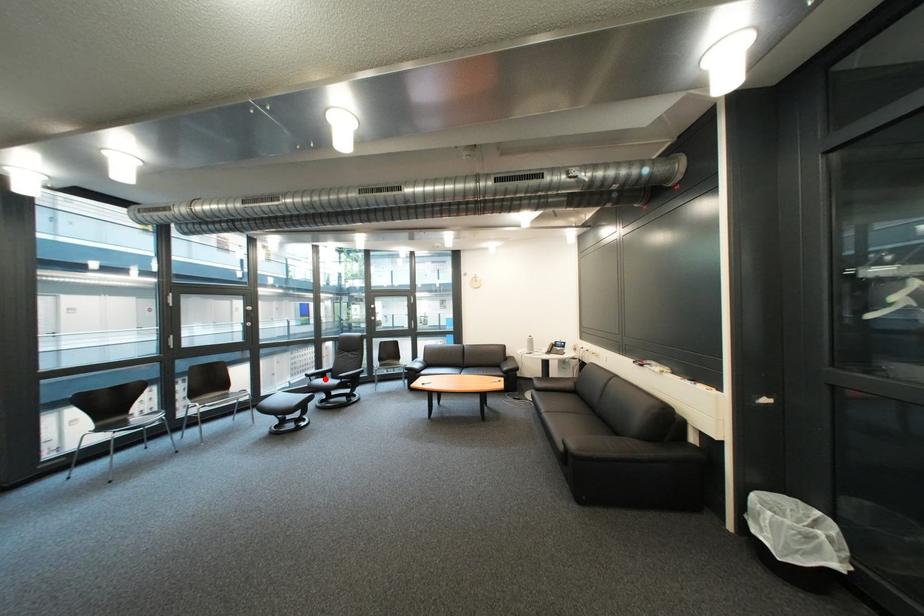
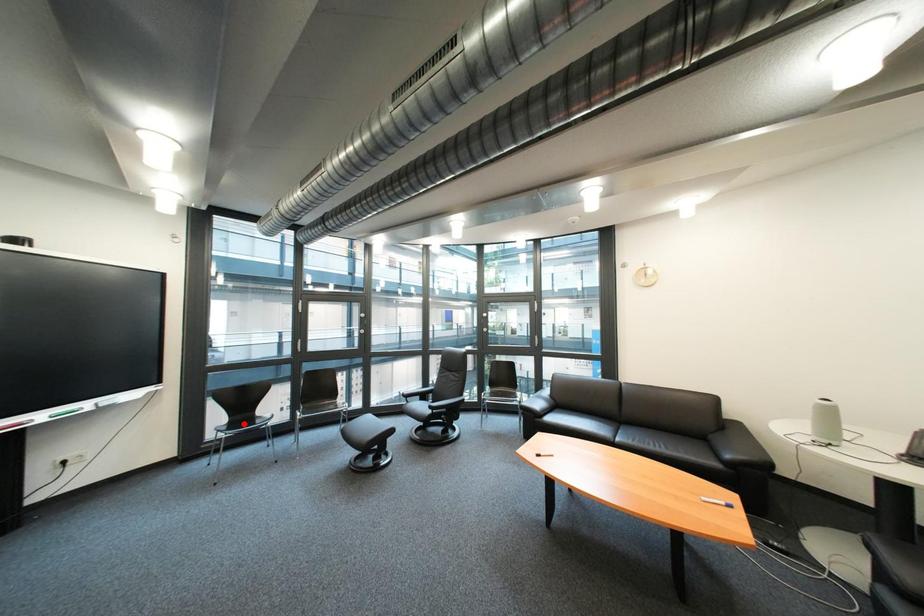
I am providing you with two images of the same scene from different viewpoints. A red point is marked on the first image and another point is marked on the second image. Is the red point in image1 aligned with the point shown in image2?

No